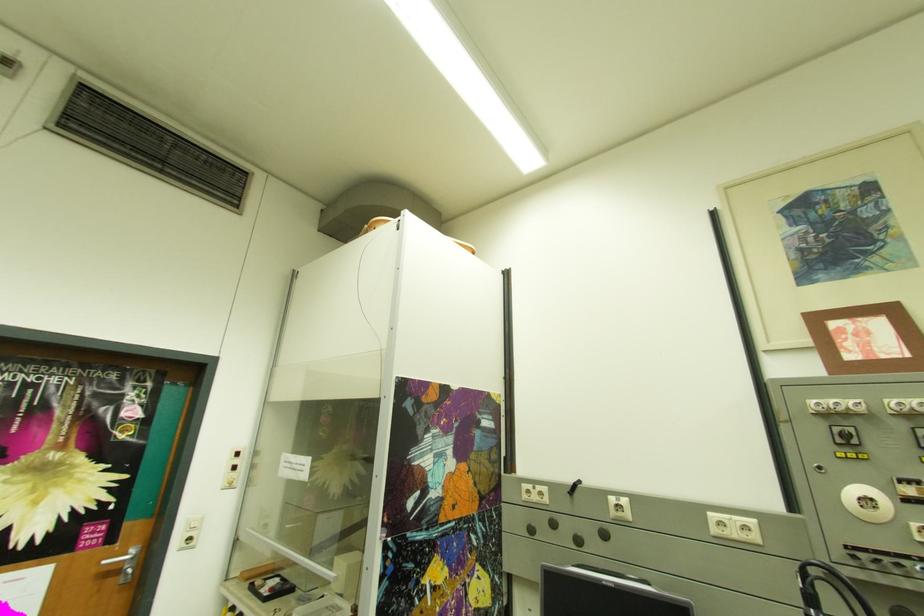
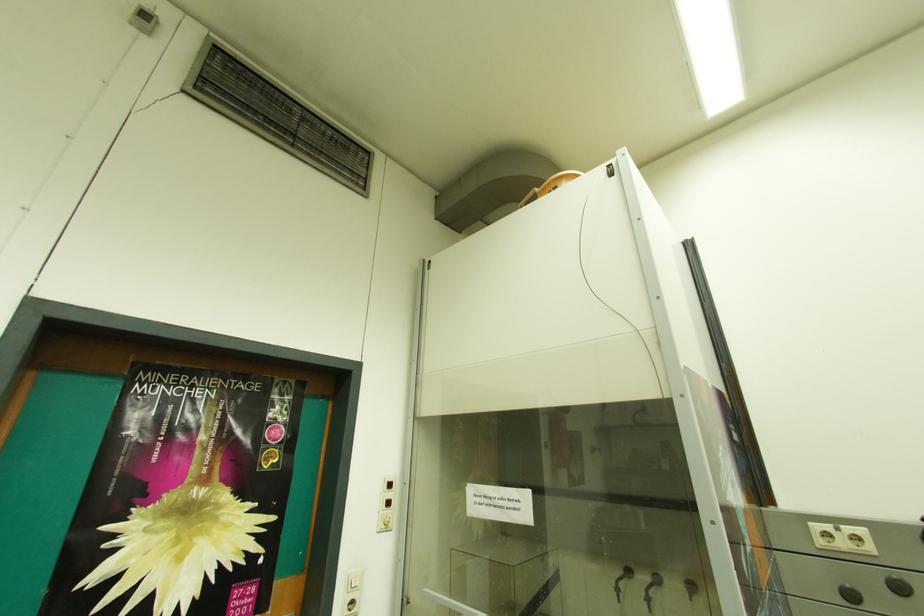
Find the pixel in the second image that matches pixel 564 525 in the first image.

(910, 590)